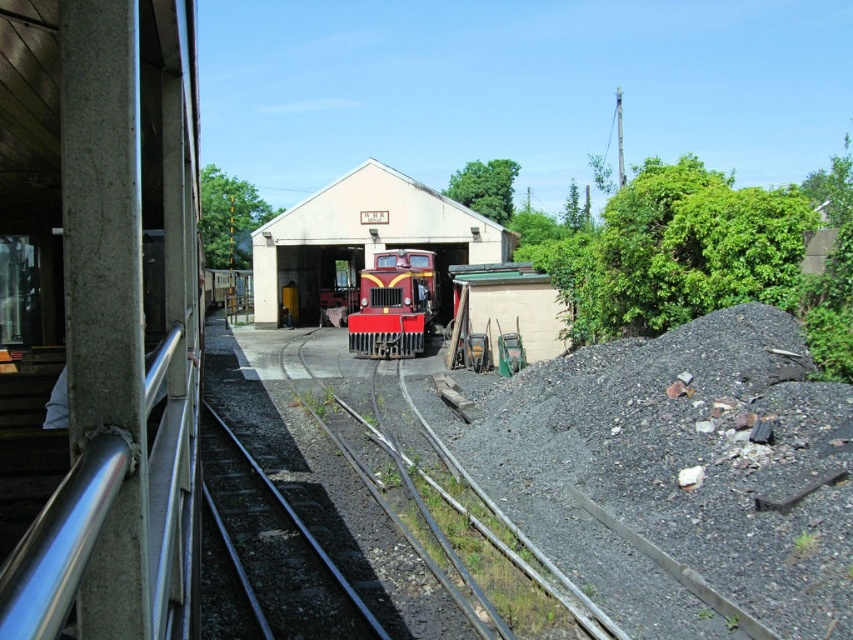
Question: Which object appears closest to the camera in this image?

Choices:
 (A) shiny red locomotive at center
 (B) matte red train at center
 (C) gray gravel at lower right

Answer: (C)

Question: Which point is farther to the camera?

Choices:
 (A) shiny red locomotive at center
 (B) matte red train at center

Answer: (B)

Question: Can you confirm if matte red train at center is bigger than shiny red locomotive at center?

Choices:
 (A) yes
 (B) no

Answer: (A)

Question: Can you confirm if matte red train at center is positioned above shiny red locomotive at center?

Choices:
 (A) no
 (B) yes

Answer: (B)

Question: Can you confirm if gray gravel at lower right is positioned to the right of matte red train at center?

Choices:
 (A) yes
 (B) no

Answer: (A)

Question: Considering the real-world distances, which object is closest to the gray gravel at lower right?

Choices:
 (A) matte red train at center
 (B) shiny red locomotive at center

Answer: (B)